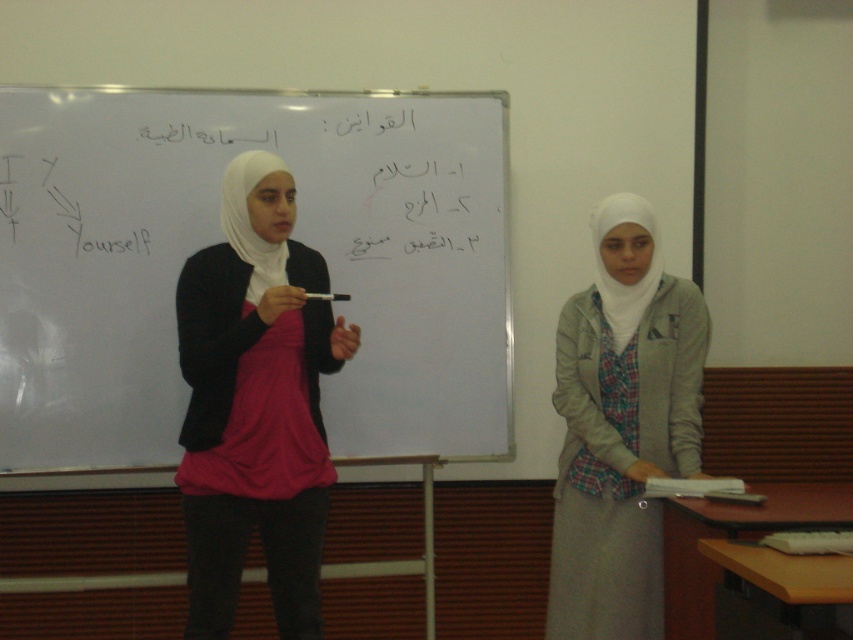
Question: Which point is farther from the camera taking this photo?

Choices:
 (A) pos(701,332)
 (B) pos(322,209)

Answer: (B)

Question: Does white matte whiteboard at center appear over light gray fabric hijab at right?

Choices:
 (A) yes
 (B) no

Answer: (A)

Question: Which is nearer to the matte pink blouse at center?

Choices:
 (A) white matte whiteboard at center
 (B) light gray fabric hijab at right

Answer: (A)

Question: Considering the real-world distances, which object is closest to the light gray fabric hijab at right?

Choices:
 (A) white matte whiteboard at center
 (B) matte pink blouse at center

Answer: (A)

Question: Is matte pink blouse at center above light gray fabric hijab at right?

Choices:
 (A) no
 (B) yes

Answer: (B)

Question: Does matte pink blouse at center have a greater width compared to light gray fabric hijab at right?

Choices:
 (A) no
 (B) yes

Answer: (B)